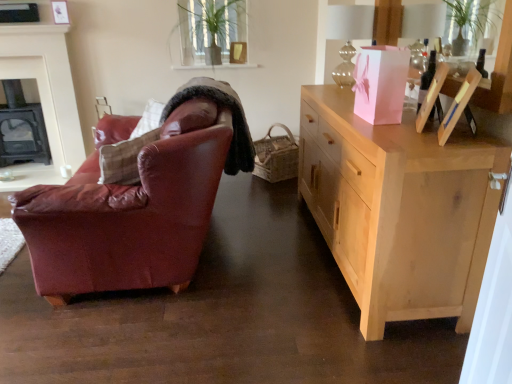
Question: In terms of size, does green leafy plant at upper center appear bigger or smaller than woven brown picnic basket at center?

Choices:
 (A) big
 (B) small

Answer: (A)

Question: Does point (216, 43) appear closer or farther from the camera than point (283, 172)?

Choices:
 (A) farther
 (B) closer

Answer: (A)

Question: Which is nearer to the green leafy plant at upper center?

Choices:
 (A) natural wood cabinet at right
 (B) black cast iron fireplace at left, the 2th fireplace in the front-to-back sequence
 (C) black cast iron fireplace at left, the 2th fireplace from the back
 (D) woven brown picnic basket at center

Answer: (D)

Question: Estimate the real-world distances between objects in this image. Which object is closer to the green leafy plant at upper center?

Choices:
 (A) natural wood cabinet at right
 (B) black cast iron fireplace at left, the 2th fireplace from the back
 (C) woven brown picnic basket at center
 (D) black cast iron fireplace at left, the 2th fireplace in the front-to-back sequence

Answer: (C)